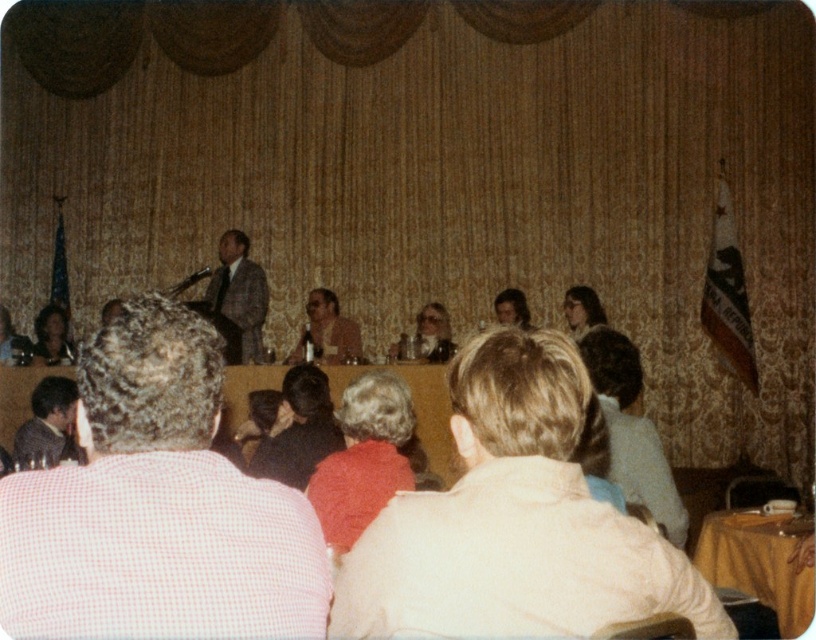
Question: Which point is closer to the camera taking this photo?

Choices:
 (A) (249, 307)
 (B) (47, 307)
 (C) (721, 525)

Answer: (C)

Question: Does plaid wool suit at center have a smaller size compared to dark brown hair at lower left?

Choices:
 (A) yes
 (B) no

Answer: (B)

Question: Can you confirm if yellow fabric table at lower right is positioned to the left of smooth brown leather jacket at lower left?

Choices:
 (A) yes
 (B) no

Answer: (B)

Question: Is yellow fabric table at lower right above plaid wool suit at center?

Choices:
 (A) yes
 (B) no

Answer: (B)

Question: Which point appears closest to the camera in this image?

Choices:
 (A) (570, 324)
 (B) (229, 305)
 (C) (521, 323)

Answer: (A)

Question: Which point is closer to the camera?

Choices:
 (A) (590, 308)
 (B) (63, 502)
 (C) (55, 340)
 (D) (406, 540)

Answer: (B)